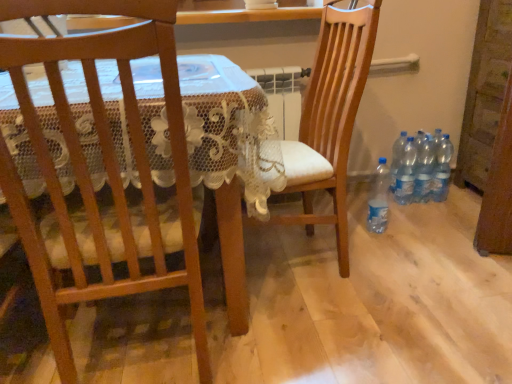
Locate an element on the screen. Image resolution: width=512 pixels, height=384 pixels. free space to the right of clear plastic bottle at lower right, which appears as the 5th bottle when viewed from the right is located at coordinates (411, 228).